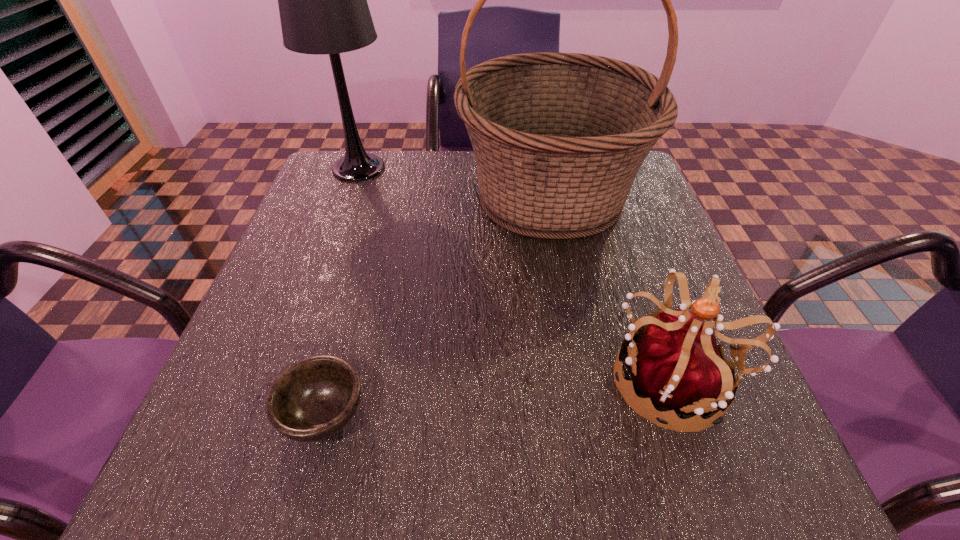
Identify the location of free location that satisfies the following two spatial constraints: 1. on the back side of the basket; 2. on the left side of the bowl. This screenshot has height=540, width=960. (382, 196).

The height and width of the screenshot is (540, 960). Find the location of `vacant space that satisfies the following two spatial constraints: 1. on the back side of the bowl; 2. on the left side of the basket`. vacant space that satisfies the following two spatial constraints: 1. on the back side of the bowl; 2. on the left side of the basket is located at coordinates (382, 196).

Where is `free space that satisfies the following two spatial constraints: 1. on the front side of the table lamp; 2. on the right side of the basket`? free space that satisfies the following two spatial constraints: 1. on the front side of the table lamp; 2. on the right side of the basket is located at coordinates (348, 196).